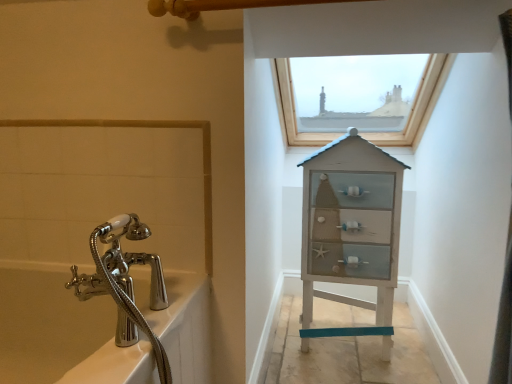
Question: Is point (304, 349) closer or farther from the camera than point (407, 109)?

Choices:
 (A) closer
 (B) farther

Answer: (A)

Question: Which is correct: white wood cabinet at center is inside wooden frame window at upper center, or outside of it?

Choices:
 (A) inside
 (B) outside

Answer: (B)

Question: Which object is the farthest from the white wood cabinet at center?

Choices:
 (A) polished chrome bath at left
 (B) wooden frame window at upper center

Answer: (A)

Question: Estimate the real-world distances between objects in this image. Which object is farther from the white wood cabinet at center?

Choices:
 (A) polished chrome bath at left
 (B) wooden frame window at upper center

Answer: (A)